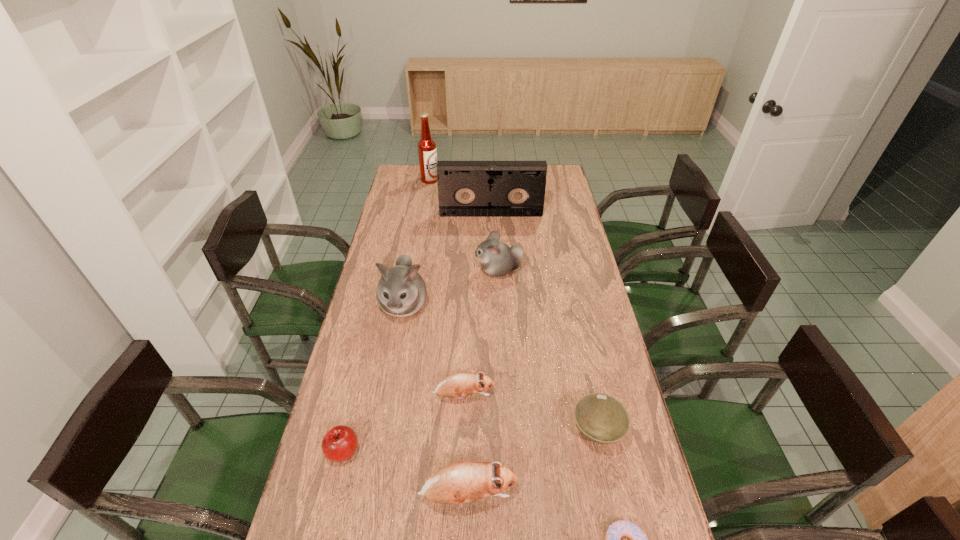
I want to click on vacant space situated on the face of the right white hamster, so click(x=449, y=271).

The height and width of the screenshot is (540, 960). What are the coordinates of `free region located 0.170m at the face of the second shortest hamster` in the screenshot? It's located at click(587, 496).

Where is `vacant region located 0.350m on the back of the pink apple`? vacant region located 0.350m on the back of the pink apple is located at coordinates (371, 337).

Identify the location of vacant space located at the face of the farther brown hamster. (533, 396).

You are a GUI agent. You are given a task and a screenshot of the screen. Output one action in this format:
    pyautogui.click(x=<x>, y=<y>)
    Task: Click on the vacant space located on the front of the gray bowl
    
    Given the screenshot: What is the action you would take?
    pyautogui.click(x=613, y=510)

The width and height of the screenshot is (960, 540). Find the location of `object present at the far edge`. object present at the far edge is located at coordinates (427, 153).

Where is `alcohol at the left edge`? This screenshot has height=540, width=960. alcohol at the left edge is located at coordinates (427, 153).

At what (x,y) coordinates should I click in order to perform the action: click on hamster at the left edge. Please return your answer as a coordinate pair (x, y). The width and height of the screenshot is (960, 540). Looking at the image, I should click on (401, 292).

The width and height of the screenshot is (960, 540). I want to click on apple located in the left edge section of the desktop, so click(340, 442).

The image size is (960, 540). I want to click on videotape located at the right edge, so click(x=465, y=188).